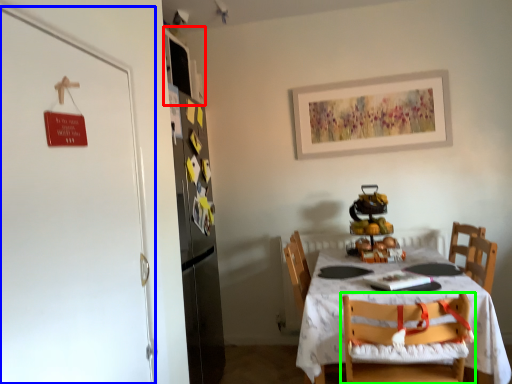
Question: Which object is positioned farthest from cabinetry (highlighted by a red box)? Select from door (highlighted by a blue box) and chair (highlighted by a green box).

Choices:
 (A) door
 (B) chair

Answer: (B)